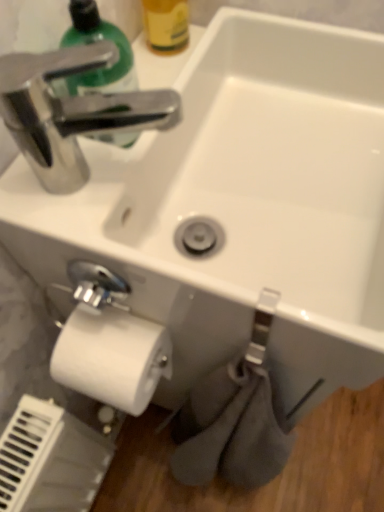
Question: From the image's perspective, relative to yellow matte bottle at upper center, is white matte toilet paper at lower left above or below?

Choices:
 (A) below
 (B) above

Answer: (A)

Question: Is white matte toilet paper at lower left spatially inside yellow matte bottle at upper center, or outside of it?

Choices:
 (A) outside
 (B) inside

Answer: (A)

Question: Which object is positioned closest to the yellow matte bottle at upper center?

Choices:
 (A) shiny green plastic soap dispenser at upper left
 (B) white matte toilet paper at lower left

Answer: (A)

Question: Which object is the farthest from the white matte toilet paper at lower left?

Choices:
 (A) yellow matte bottle at upper center
 (B) shiny green plastic soap dispenser at upper left

Answer: (A)